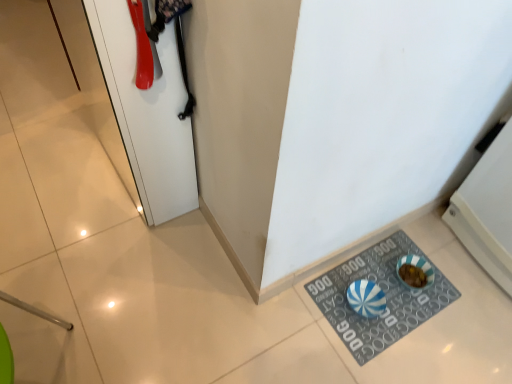
At what (x,y) coordinates should I click in order to perform the action: click on free point above blue and white striped rubber mat at lower right (from a real-world perspective). Please return your answer as a coordinate pair (x, y). The width and height of the screenshot is (512, 384). Looking at the image, I should click on (381, 294).